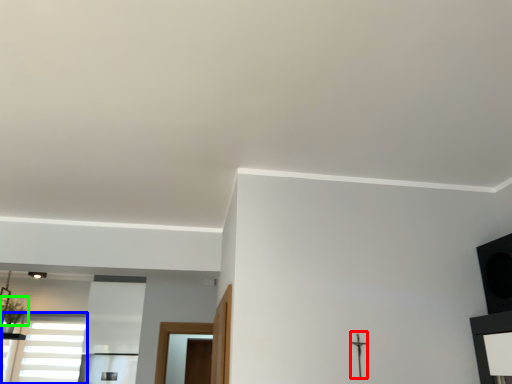
Question: Which is farther away from crucifix (highlighted by a red box)? window (highlighted by a blue box) or plant (highlighted by a green box)?

Choices:
 (A) window
 (B) plant

Answer: (B)